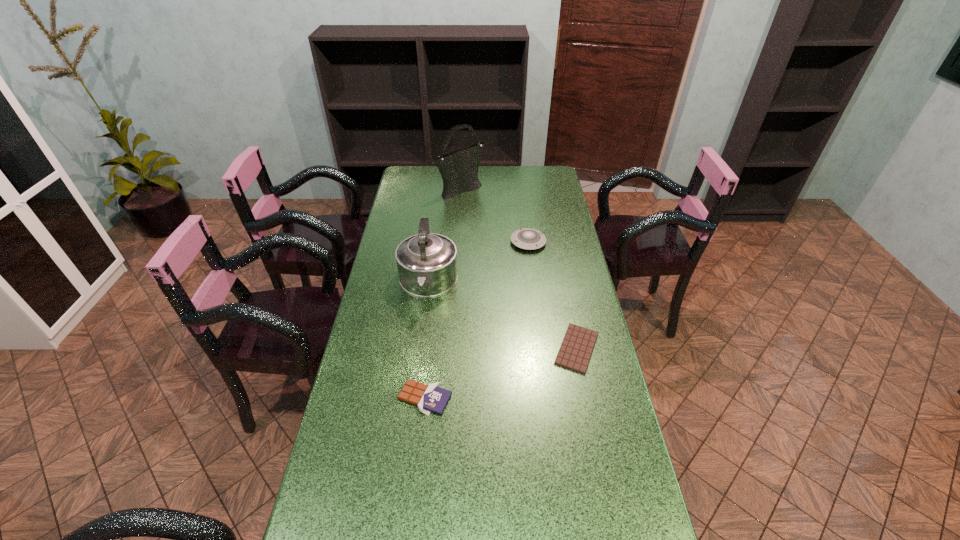
I want to click on free point at the far edge, so click(498, 166).

In the image, there is a desktop. Where is `vacant space at the left edge`? The image size is (960, 540). vacant space at the left edge is located at coordinates (381, 329).

You are a GUI agent. You are given a task and a screenshot of the screen. Output one action in this format:
    pyautogui.click(x=<x>, y=<y>)
    Task: Click on the vacant area at the right edge of the desktop
    This screenshot has width=960, height=540.
    Given the screenshot: What is the action you would take?
    pyautogui.click(x=634, y=475)

Locate an element on the screen. The image size is (960, 540). free space at the far right corner of the desktop is located at coordinates (525, 187).

The height and width of the screenshot is (540, 960). I want to click on empty space between the second tallest object and the left chocolate bar, so click(426, 341).

Find the location of a particular element. free point between the farthest object and the kettle is located at coordinates (444, 236).

Find the location of a particular element. empty space that is in between the farther chocolate bar and the farthest object is located at coordinates (519, 268).

Image resolution: width=960 pixels, height=540 pixels. I want to click on vacant space that is in between the second tallest object and the farthest object, so click(444, 236).

Identify the location of object identified as the closest to the second tallest object. Image resolution: width=960 pixels, height=540 pixels. (530, 239).

Identify the location of the second closest object to the shoulder bag. (427, 263).